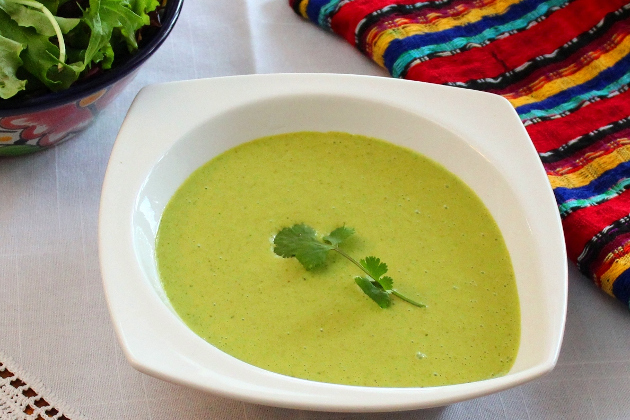
Where is `salad bowl`? salad bowl is located at coordinates tap(55, 133).